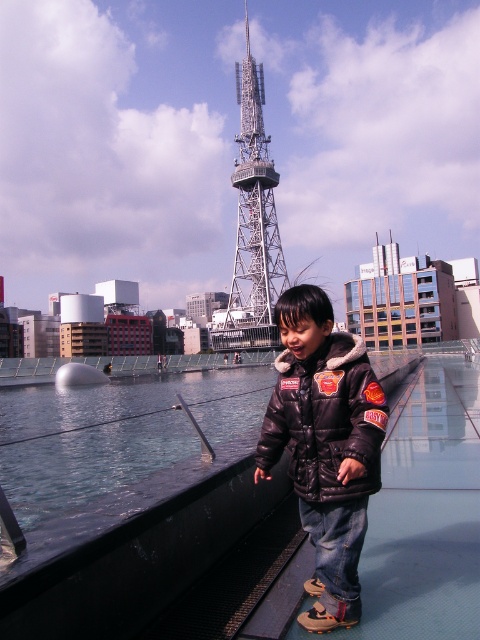
Question: Can you confirm if black fuzzy-lined jacket at center is positioned to the right of metallic silver tower at center?

Choices:
 (A) yes
 (B) no

Answer: (A)

Question: Is black fuzzy-lined jacket at center further to camera compared to metallic silver tower at center?

Choices:
 (A) no
 (B) yes

Answer: (A)

Question: Does black fuzzy-lined jacket at center appear over metallic silver tower at center?

Choices:
 (A) yes
 (B) no

Answer: (B)

Question: Among these points, which one is nearest to the camera?

Choices:
 (A) (305, 448)
 (B) (241, 198)

Answer: (A)

Question: Which object is farther from the camera taking this photo?

Choices:
 (A) black fuzzy-lined jacket at center
 (B) metallic silver tower at center

Answer: (B)

Question: Which point is closer to the camera taking this photo?

Choices:
 (A) (381, 444)
 (B) (242, 67)

Answer: (A)